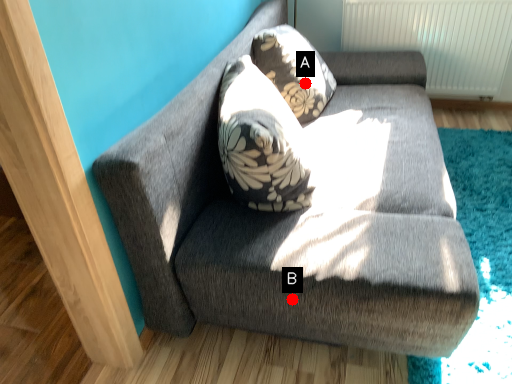
Question: Two points are circled on the image, labeled by A and B beside each circle. Which of the following is the closest to the observer?

Choices:
 (A) A is closer
 (B) B is closer

Answer: (B)